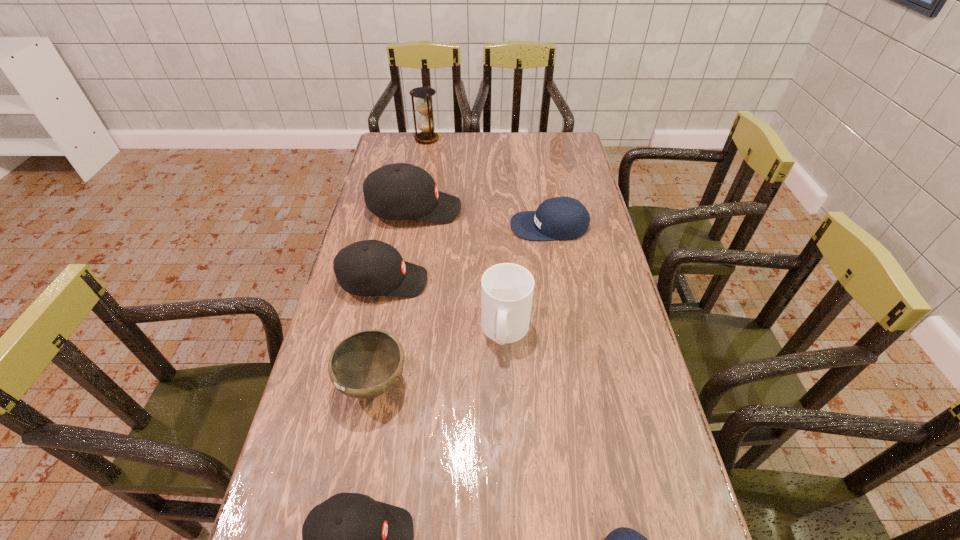
The width and height of the screenshot is (960, 540). I want to click on object present at the right edge, so click(564, 218).

Where is `object present at the far left corner`? Image resolution: width=960 pixels, height=540 pixels. object present at the far left corner is located at coordinates (423, 104).

The height and width of the screenshot is (540, 960). I want to click on blank area at the far edge, so click(473, 138).

This screenshot has height=540, width=960. In the image, there is a desktop. Find the location of `vacant space at the right edge`. vacant space at the right edge is located at coordinates (621, 299).

This screenshot has width=960, height=540. Identify the location of vacant space that is in between the mug and the bowl. (440, 356).

I want to click on free area in between the farthest object and the bigger blue baseball cap, so click(x=488, y=183).

Find the location of `free space between the farther blue baseball cap and the tallest baseball cap`. free space between the farther blue baseball cap and the tallest baseball cap is located at coordinates (482, 218).

Choose which object is the third nearest neighbor to the smallest gray baseball cap. Please provide its 2D coordinates. Your answer should be formatted as a tuple, i.e. [(x, y)], where the tuple contains the x and y coordinates of a point satisfying the conditions above.

[(507, 289)]

Identify the location of the fifth closest object to the farthest gray baseball cap. (366, 364).

The height and width of the screenshot is (540, 960). In order to click on baseball cap that is the second nearest to the hourglass in this screenshot , I will do `click(564, 218)`.